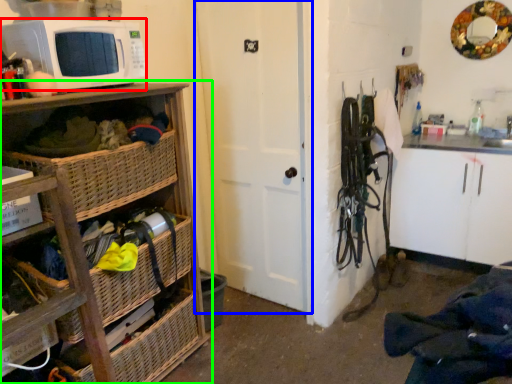
Question: Which is farther away from microwave oven (highlighted by a red box)? door (highlighted by a blue box) or cabinetry (highlighted by a green box)?

Choices:
 (A) door
 (B) cabinetry

Answer: (A)